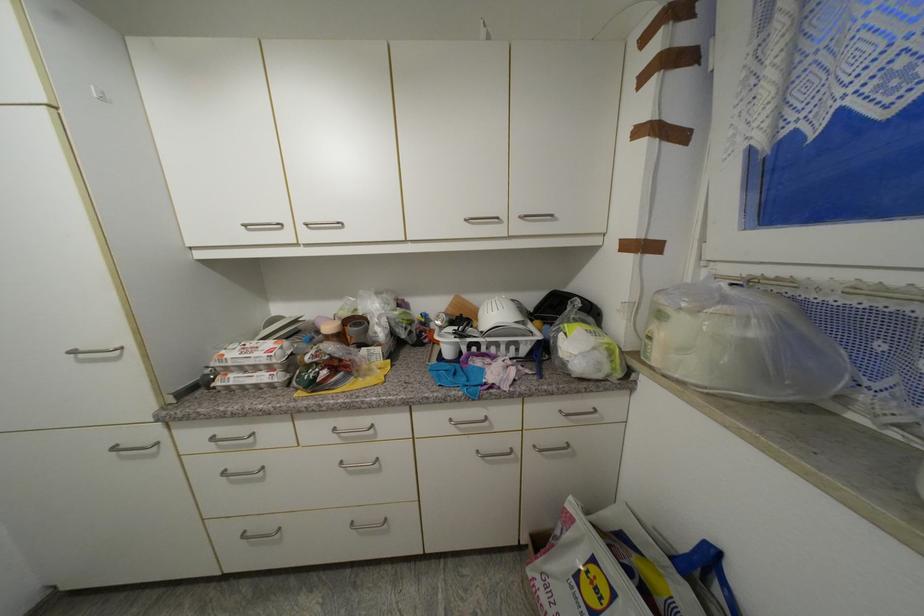
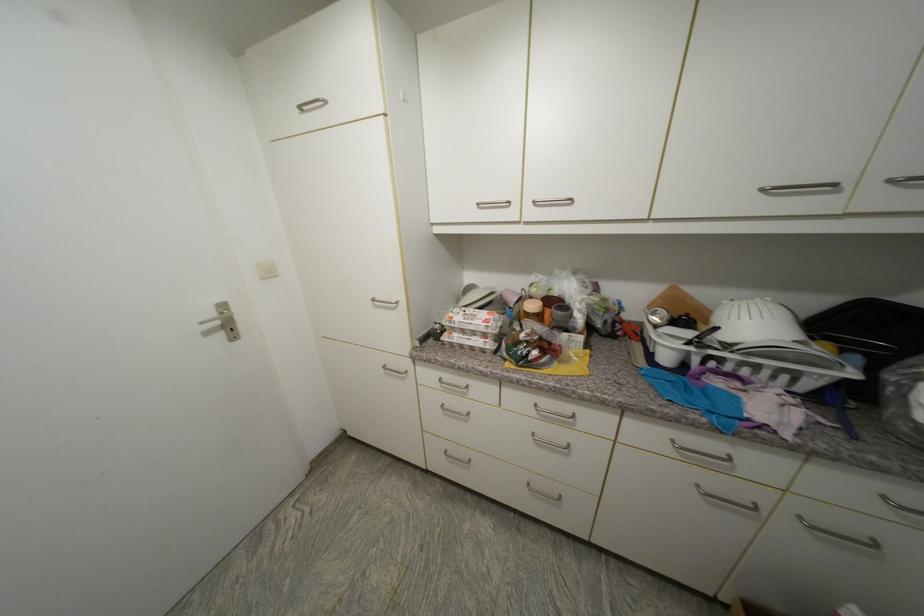
In the second image, find the point that corresponds to pixel 250 227 in the first image.

(483, 206)